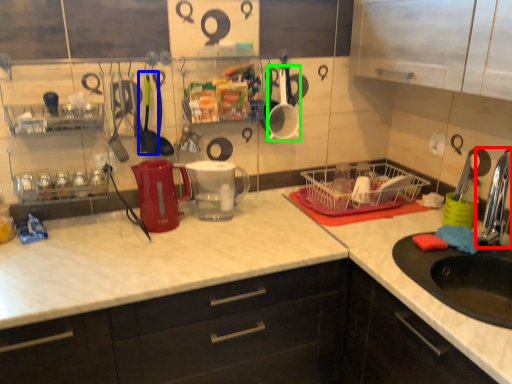
Question: Which is nearer to the faucet (highlighted by a red box)? tableware (highlighted by a blue box) or tableware (highlighted by a green box).

Choices:
 (A) tableware
 (B) tableware

Answer: (B)